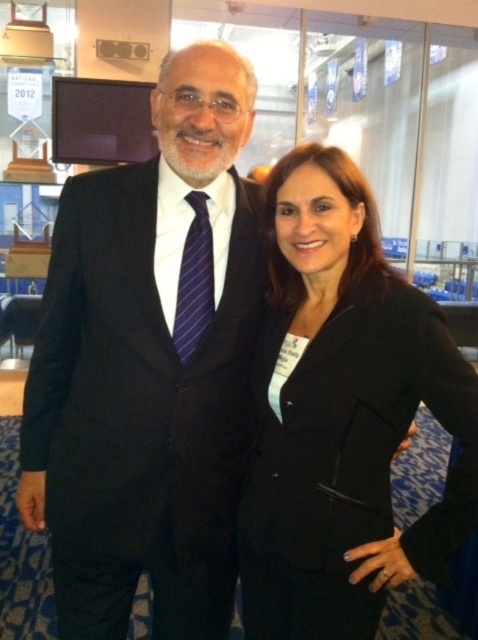
Question: Is black matte blazer at center above purple striped tie at center?

Choices:
 (A) no
 (B) yes

Answer: (A)

Question: Which of the following is the farthest from the observer?

Choices:
 (A) (243, 324)
 (B) (336, 374)

Answer: (A)

Question: Is black matte blazer at center thinner than purple striped tie at center?

Choices:
 (A) no
 (B) yes

Answer: (A)

Question: Among these objects, which one is nearest to the camera?

Choices:
 (A) black matte suit at center
 (B) black matte blazer at center
 (C) purple striped tie at center

Answer: (B)

Question: Does black matte blazer at center have a larger size compared to purple striped tie at center?

Choices:
 (A) no
 (B) yes

Answer: (B)

Question: Which point is closer to the camera taking this photo?

Choices:
 (A) (203, 212)
 (B) (202, 468)
 (C) (383, 436)

Answer: (C)